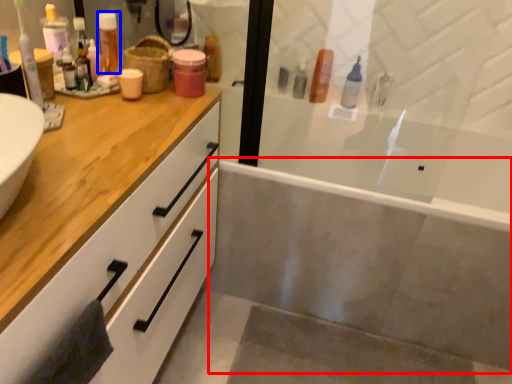
Question: Which object appears farthest to the camera in this image, bath (highlighted by a red box) or toiletry (highlighted by a blue box)?

Choices:
 (A) bath
 (B) toiletry

Answer: (A)